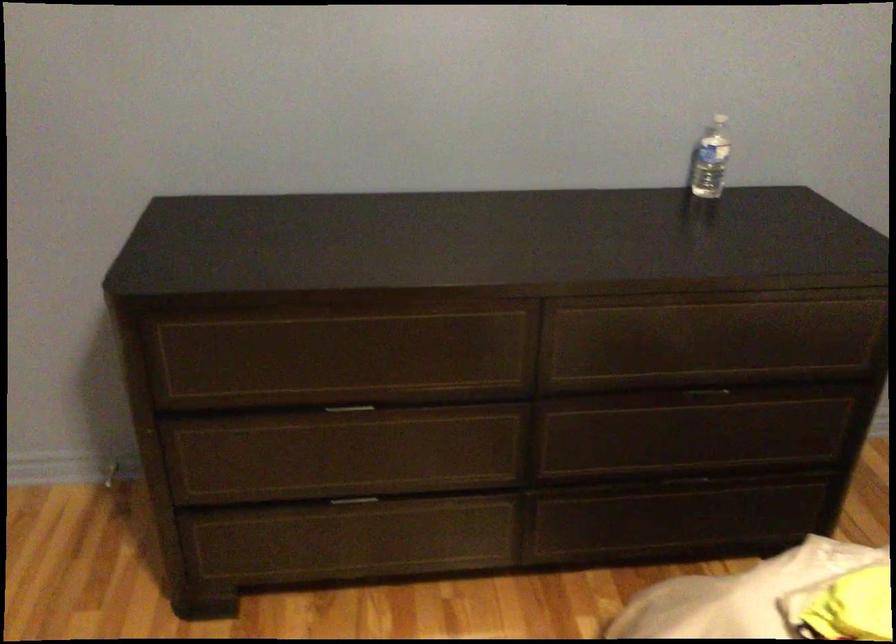
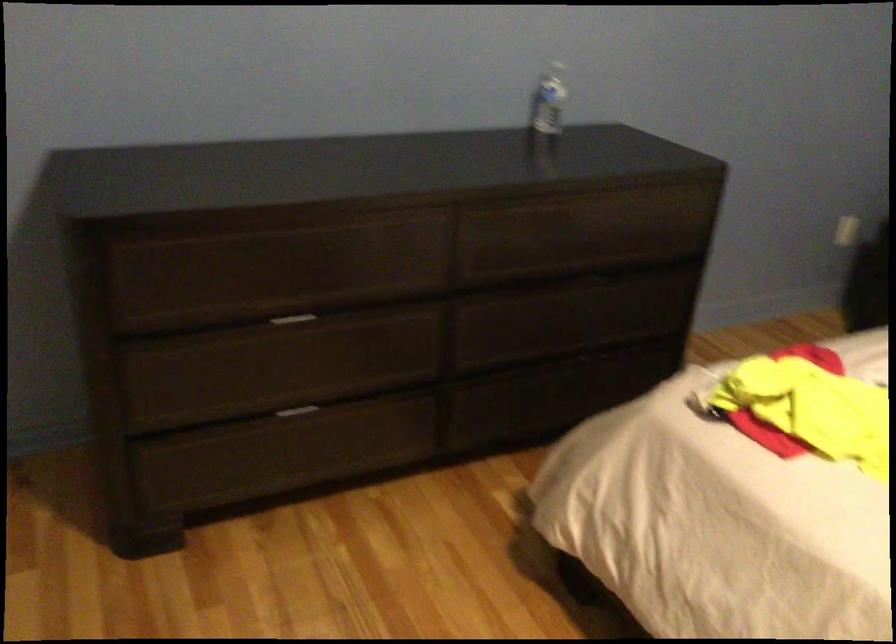
The point at (355, 408) is marked in the first image. Where is the corresponding point in the second image?

(291, 319)